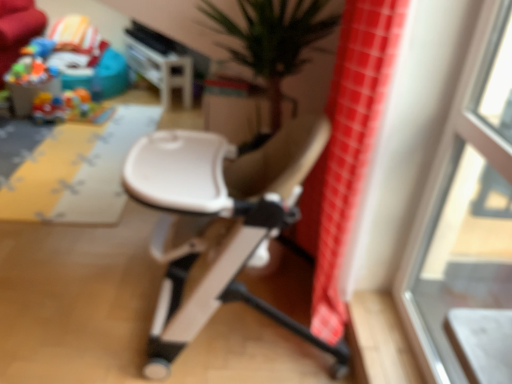
You are a GUI agent. You are given a task and a screenshot of the screen. Output one action in this format:
    pyautogui.click(x=<x>, y=<y>)
    Task: Click on the vacant space situated on the left part of white plastic chair at center
    The width and height of the screenshot is (512, 384).
    Given the screenshot: What is the action you would take?
    pyautogui.click(x=84, y=292)